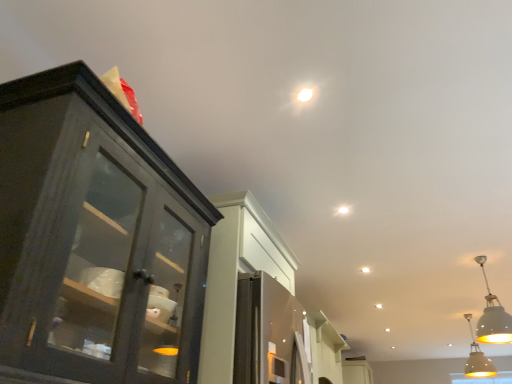
Question: From the image's perspective, is white matte pendant light at lower right, which is the 1th light fixture from top to bottom, positioned above or below matte yellow pendant light at lower right, the first light fixture when ordered from bottom to top?

Choices:
 (A) below
 (B) above

Answer: (B)

Question: Is white matte pendant light at lower right, which is the 1th light fixture from top to bottom, wider or thinner than matte yellow pendant light at lower right, the second light fixture when ordered from left to right?

Choices:
 (A) thin
 (B) wide

Answer: (A)

Question: Based on their relative distances, which object is nearer to the white matte ceiling light at upper center?

Choices:
 (A) white matte pendant light at lower right, marked as the second light fixture in a bottom-to-top arrangement
 (B) white matte droplight at upper center
 (C) matte yellow pendant light at lower right, which is counted as the second light fixture, starting from the top
 (D) white matte cabinet at center

Answer: (B)

Question: Which of these objects is positioned farthest from the matte yellow pendant light at lower right, which is counted as the second light fixture, starting from the top?

Choices:
 (A) white matte cabinet at center
 (B) white matte droplight at upper center
 (C) white matte pendant light at lower right, the 2th light fixture when ordered from right to left
 (D) white matte ceiling light at upper center

Answer: (B)